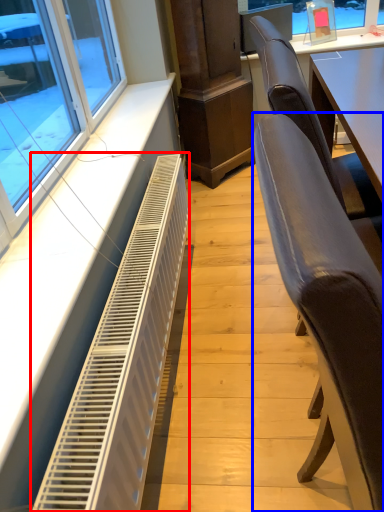
Question: Among these objects, which one is nearest to the camera, air conditioning (highlighted by a red box) or chair (highlighted by a blue box)?

Choices:
 (A) air conditioning
 (B) chair

Answer: (B)